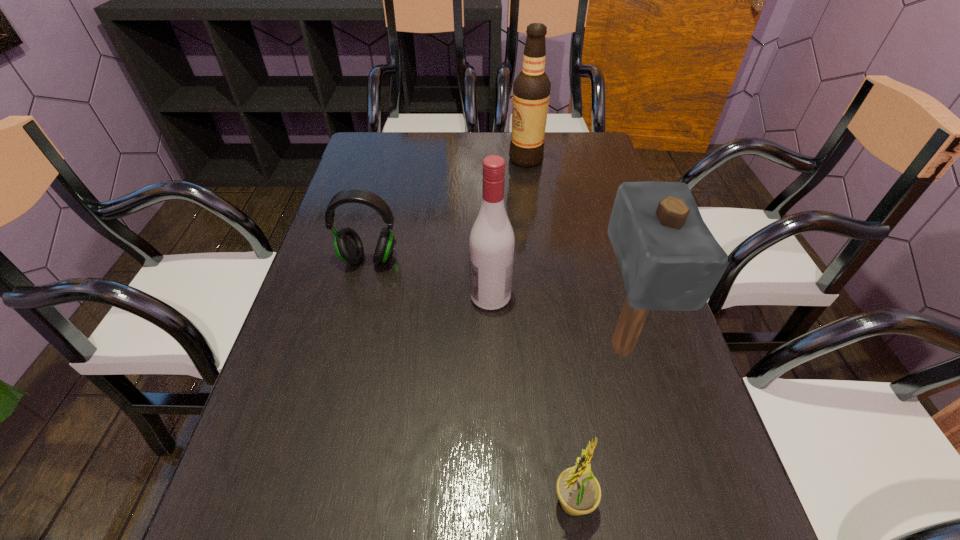
Identify the location of free space located 0.180m on the label of the farther alcohol. (453, 159).

You are a GUI agent. You are given a task and a screenshot of the screen. Output one action in this format:
    pyautogui.click(x=<x>, y=<y>)
    Task: Click on the free space located 0.130m on the front of the rightmost object
    This screenshot has height=540, width=960.
    Given the screenshot: What is the action you would take?
    pyautogui.click(x=651, y=456)

Identify the location of free location located on the label of the fourth object from right to left. (378, 296).

The width and height of the screenshot is (960, 540). I want to click on free region located 0.050m on the label of the fourth object from right to left, so click(x=448, y=296).

Locate an element on the screen. The height and width of the screenshot is (540, 960). vacant space positioned on the label of the fourth object from right to left is located at coordinates (365, 296).

What are the coordinates of `vacant region located 0.280m on the ear cups of the headset` in the screenshot? It's located at (340, 373).

Where is `free spot located 0.130m on the face of the sunflower`? This screenshot has height=540, width=960. free spot located 0.130m on the face of the sunflower is located at coordinates (468, 502).

Locate an element on the screen. This screenshot has width=960, height=540. free space located on the face of the sunflower is located at coordinates (513, 502).

This screenshot has height=540, width=960. Find the location of `vacant space located 0.380m on the face of the sunflower`. vacant space located 0.380m on the face of the sunflower is located at coordinates (312, 502).

Locate an element on the screen. The image size is (960, 540). object that is positioned at the far edge is located at coordinates coord(531,89).